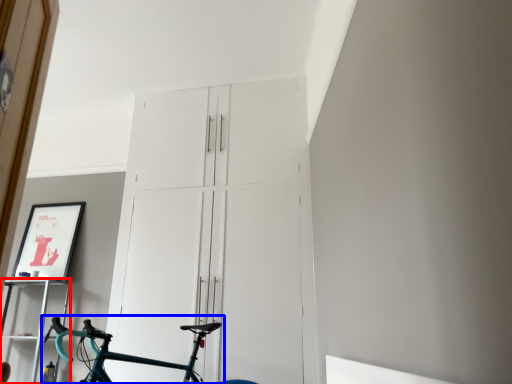
Question: Which object appears farthest to the camera in this image, shelf (highlighted by a red box) or bicycle (highlighted by a blue box)?

Choices:
 (A) shelf
 (B) bicycle

Answer: (A)